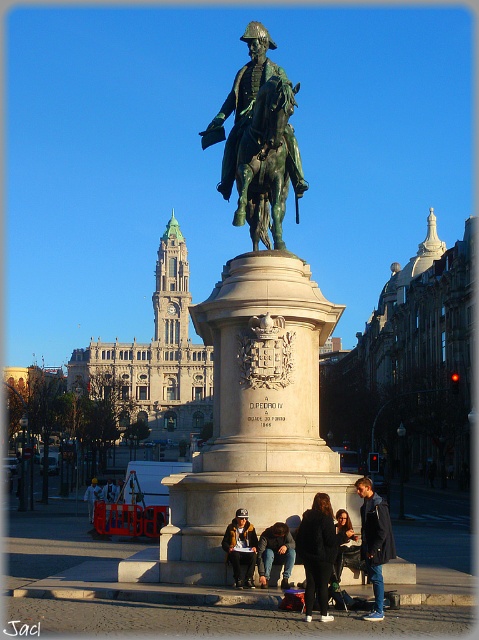
Question: Which point is farther to the camera?

Choices:
 (A) (266, 579)
 (B) (226, 369)
 (C) (348, 531)
 (D) (391, 554)

Answer: (B)

Question: Which object is the farthest from the green patina statue at center?

Choices:
 (A) black leather jacket at lower center
 (B) matte black jacket at lower center
 (C) green bronze statue at center
 (D) dark brown leather jacket at lower center

Answer: (B)

Question: Where is green patina statue at center located in relation to green patina horse at center in the image?

Choices:
 (A) right
 (B) left

Answer: (B)

Question: Which point is farther from the camera taking this photo?

Choices:
 (A) pos(88,490)
 (B) pos(318,566)
 (C) pos(228,545)
 (D) pos(280,310)

Answer: (A)

Question: Is green bronze statue at center bigger than green patina horse at center?

Choices:
 (A) yes
 (B) no

Answer: (A)

Question: In this image, where is dark brown leather jacket at lower center located relative to light blue denim jacket at lower center?

Choices:
 (A) above
 (B) below

Answer: (A)